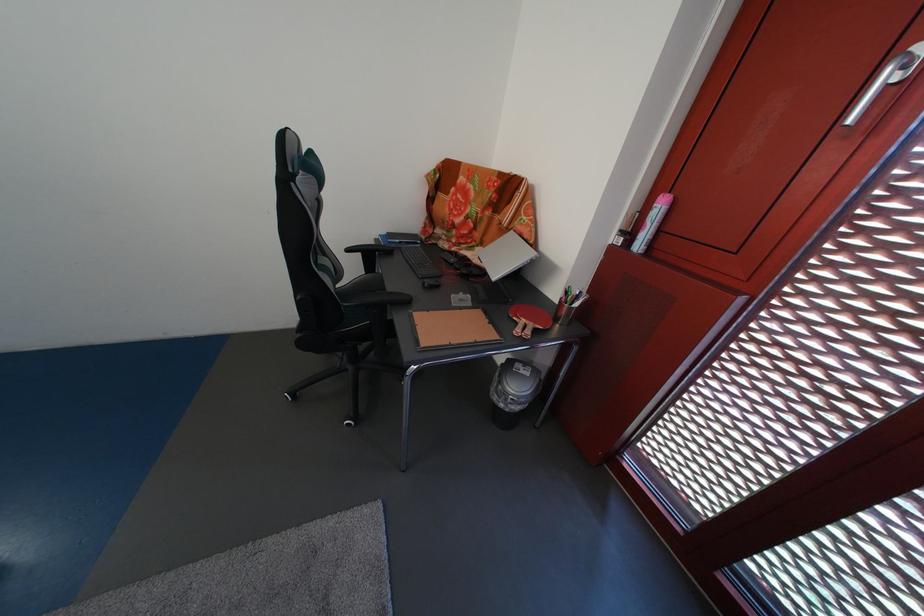
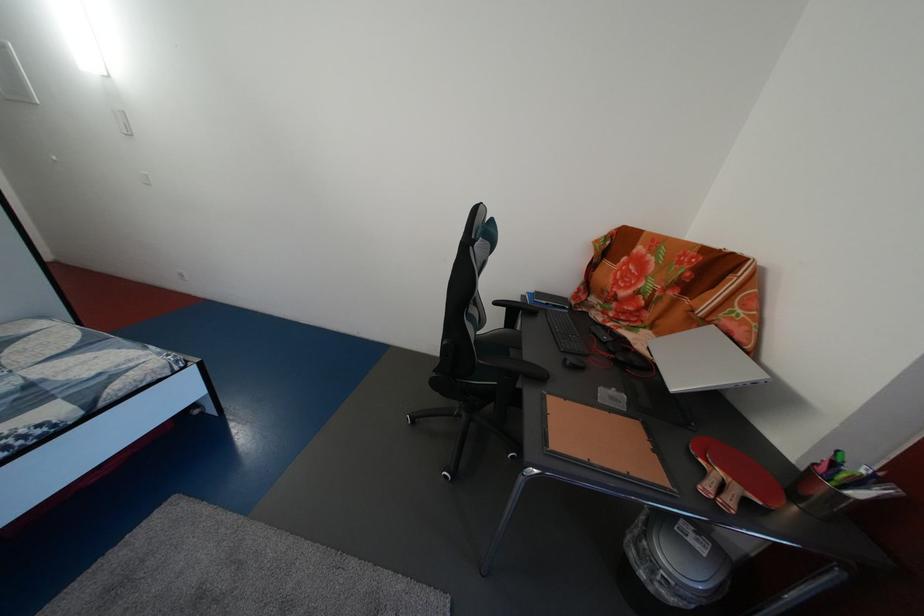
Locate, in the second image, the point that corresponds to point (542, 331) in the first image.

(748, 496)